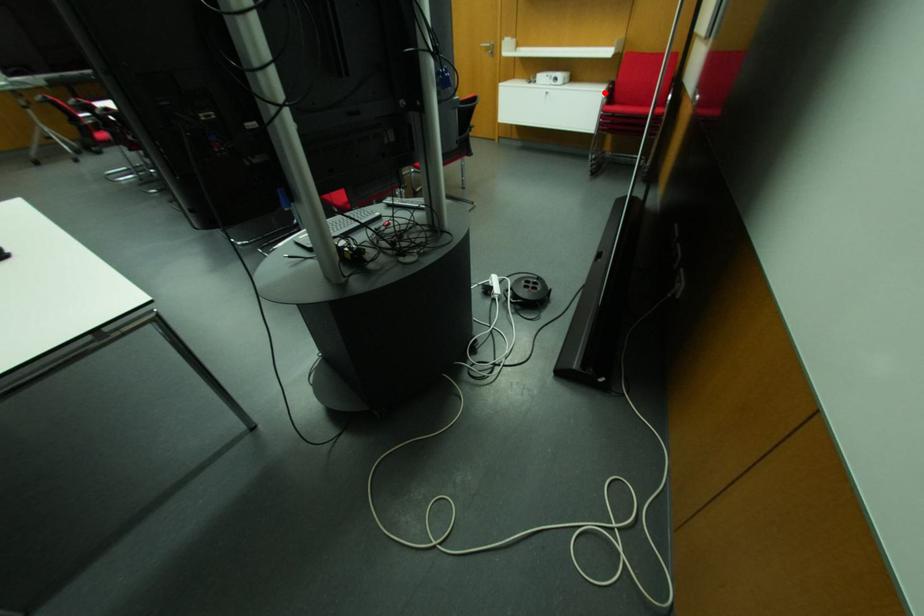
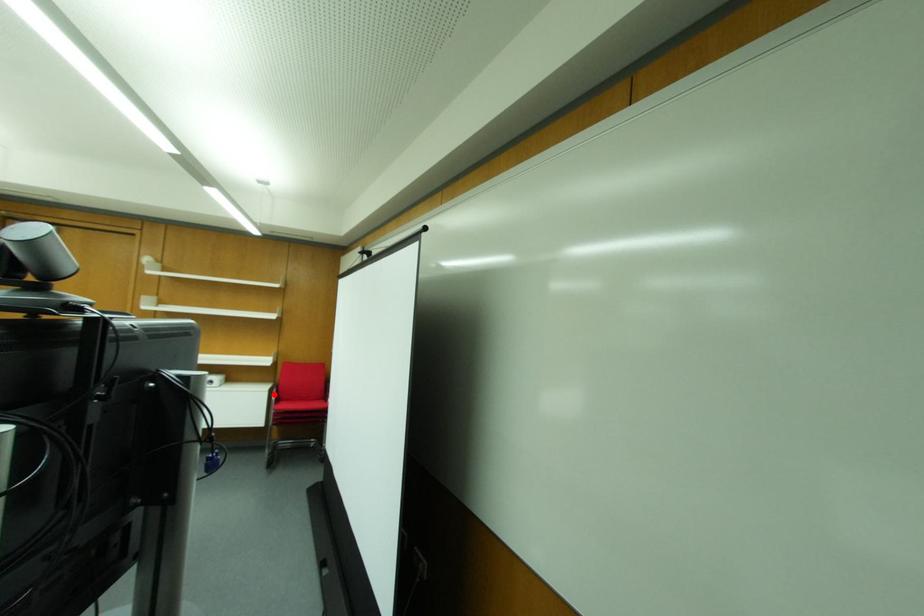
I am providing you with two images of the same scene from different viewpoints. A red point is marked on the first image and another point is marked on the second image. Do the highlighted points in image1 and image2 indicate the same real-world spot?

Yes